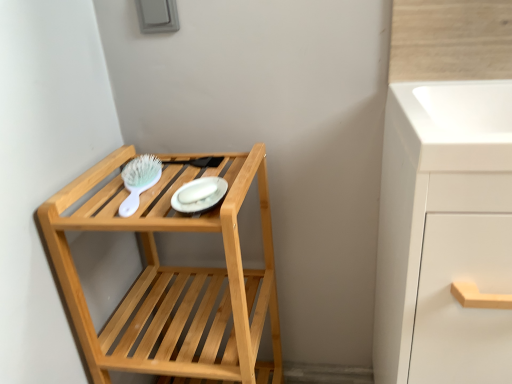
Describe the element at coordinates (199, 195) in the screenshot. I see `white glossy platter at center` at that location.

What is the approximate width of white matte cabinet at right?

The width of white matte cabinet at right is 16.03 inches.

What is the approximate height of natural wood shelf at left?

natural wood shelf at left is 30.00 inches in height.

Find the location of `white glossy platter at center`. white glossy platter at center is located at coordinates (199, 195).

Considering the positions of point (470, 249) and point (124, 186), is point (470, 249) closer or farther from the camera than point (124, 186)?

Point (470, 249) appears to be closer to the viewer than point (124, 186).

Is white matte cabinet at right far from natural wood shelf at left?

white matte cabinet at right is actually quite close to natural wood shelf at left.

Locate an element on the screen. bathroom cabinet in front of the natural wood shelf at left is located at coordinates (444, 233).

Does white matte cabinet at right have a lesser width compared to natural wood shelf at left?

No.

There is a natural wood shelf at left. In order to click on brush above it (from a real-world perspective) in this screenshot , I will do `click(139, 180)`.

Is green plastic brush at upper left positioned with its back to natural wood shelf at left?

Yes, green plastic brush at upper left is facing away from natural wood shelf at left.

Looking at the image, does green plastic brush at upper left seem bigger or smaller compared to natural wood shelf at left?

Considering their sizes, green plastic brush at upper left takes up less space than natural wood shelf at left.

Considering the positions of objects green plastic brush at upper left and natural wood shelf at left in the image provided, who is more to the left, green plastic brush at upper left or natural wood shelf at left?

green plastic brush at upper left.

Could you tell me if white matte cabinet at right is facing green plastic brush at upper left?

No, white matte cabinet at right is not turned towards green plastic brush at upper left.

Is point (472, 209) positioned before point (155, 168)?

Yes, it is in front of point (155, 168).

Considering the relative sizes of white matte cabinet at right and green plastic brush at upper left in the image provided, is white matte cabinet at right bigger than green plastic brush at upper left?

Yes, white matte cabinet at right is bigger than green plastic brush at upper left.

Which is more to the right, white matte cabinet at right or green plastic brush at upper left?

white matte cabinet at right.

Which is closer to the camera, (x=216, y=183) or (x=469, y=339)?

The point (x=469, y=339) is in front.

From a real-world perspective, is white glossy platter at center positioned under white matte cabinet at right based on gravity?

No, from a real-world perspective, white glossy platter at center is not under white matte cabinet at right.

Is white glossy platter at center touching white matte cabinet at right?

No, white glossy platter at center is not next to white matte cabinet at right.

How far apart are natural wood shelf at left and green plastic brush at upper left?

A distance of 23.48 centimeters exists between natural wood shelf at left and green plastic brush at upper left.

From a real-world perspective, is natural wood shelf at left physically located above or below green plastic brush at upper left?

natural wood shelf at left is situated lower than green plastic brush at upper left in the real world.

Does natural wood shelf at left have a larger size compared to green plastic brush at upper left?

Yes.

Between point (153, 302) and point (154, 163), which one is positioned in front?

The point (154, 163) is in front.

Looking at this image, considering the sizes of objects white glossy platter at center and green plastic brush at upper left in the image provided, who is thinner, white glossy platter at center or green plastic brush at upper left?

With smaller width is white glossy platter at center.

Is white glossy platter at center far from green plastic brush at upper left?

white glossy platter at center is actually quite close to green plastic brush at upper left.

Which object is further away from the camera, white glossy platter at center or green plastic brush at upper left?

green plastic brush at upper left is further from the camera.

Is white glossy platter at center to the left of green plastic brush at upper left from the viewer's perspective?

In fact, white glossy platter at center is to the right of green plastic brush at upper left.

The image size is (512, 384). What are the coordinates of `furniture below the white glossy platter at center (from the image's perspective)` in the screenshot? It's located at (173, 278).

Which of these two, natural wood shelf at left or white glossy platter at center, is bigger?

Bigger between the two is natural wood shelf at left.

Is natural wood shelf at left taller or shorter than white glossy platter at center?

In the image, natural wood shelf at left appears to be taller than white glossy platter at center.

Identify the location of bathroom cabinet above the natural wood shelf at left (from the image's perspective). (444, 233).

This screenshot has height=384, width=512. I want to click on furniture below the green plastic brush at upper left (from a real-world perspective), so click(x=173, y=278).

From the image, which object appears to be farther from white glossy platter at center, natural wood shelf at left or green plastic brush at upper left?

Among the two, natural wood shelf at left is located further to white glossy platter at center.

In the scene shown: Which object lies further to the anchor point white glossy platter at center, green plastic brush at upper left or white matte cabinet at right?

white matte cabinet at right.

Considering their positions, is white glossy platter at center positioned further to white matte cabinet at right than green plastic brush at upper left?

green plastic brush at upper left.

From the image, which object appears to be nearer to green plastic brush at upper left, white matte cabinet at right or white glossy platter at center?

white glossy platter at center lies closer to green plastic brush at upper left than the other object.

Based on their spatial positions, is white glossy platter at center or natural wood shelf at left closer to green plastic brush at upper left?

white glossy platter at center is closer to green plastic brush at upper left.

Estimate the real-world distances between objects in this image. Which object is closer to natural wood shelf at left, white matte cabinet at right or white glossy platter at center?

The object closer to natural wood shelf at left is white glossy platter at center.

Estimate the real-world distances between objects in this image. Which object is closer to white glossy platter at center, white matte cabinet at right or natural wood shelf at left?

Based on the image, natural wood shelf at left appears to be nearer to white glossy platter at center.

From the image, which object appears to be nearer to white glossy platter at center, white matte cabinet at right or green plastic brush at upper left?

The object closer to white glossy platter at center is green plastic brush at upper left.

Find the location of `furniture situated between green plastic brush at upper left and white matte cabinet at right from left to right`. furniture situated between green plastic brush at upper left and white matte cabinet at right from left to right is located at coordinates (173, 278).

The width and height of the screenshot is (512, 384). I want to click on platter between natural wood shelf at left and white matte cabinet at right in the horizontal direction, so click(x=199, y=195).

Where is `platter between green plastic brush at upper left and natural wood shelf at left from top to bottom`? This screenshot has width=512, height=384. platter between green plastic brush at upper left and natural wood shelf at left from top to bottom is located at coordinates (199, 195).

Where is `platter between green plastic brush at upper left and white matte cabinet at right in the horizontal direction`? Image resolution: width=512 pixels, height=384 pixels. platter between green plastic brush at upper left and white matte cabinet at right in the horizontal direction is located at coordinates (x=199, y=195).